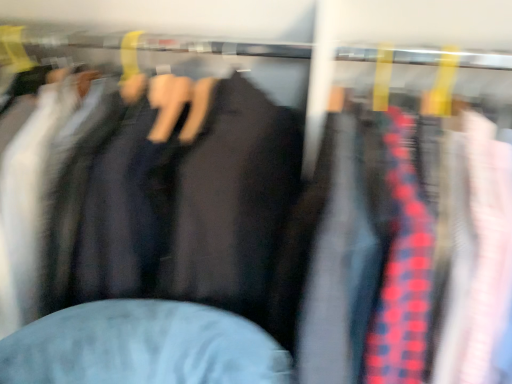
Question: Does matte black jacket at center have a greater width compared to red plaid shirt at right?

Choices:
 (A) yes
 (B) no

Answer: (A)

Question: Is matte black jacket at center at the right side of red plaid shirt at right?

Choices:
 (A) yes
 (B) no

Answer: (B)

Question: From a real-world perspective, is matte black jacket at center beneath red plaid shirt at right?

Choices:
 (A) yes
 (B) no

Answer: (B)

Question: Does matte black jacket at center turn towards red plaid shirt at right?

Choices:
 (A) yes
 (B) no

Answer: (B)

Question: Considering the relative sizes of matte black jacket at center and red plaid shirt at right in the image provided, is matte black jacket at center smaller than red plaid shirt at right?

Choices:
 (A) yes
 (B) no

Answer: (B)

Question: From a real-world perspective, is matte black jacket at center positioned over red plaid shirt at right based on gravity?

Choices:
 (A) no
 (B) yes

Answer: (B)

Question: Could matte black jacket at center be considered to be inside red plaid shirt at right?

Choices:
 (A) no
 (B) yes

Answer: (A)

Question: Is red plaid shirt at right looking in the opposite direction of matte black jacket at center?

Choices:
 (A) yes
 (B) no

Answer: (B)

Question: From the image's perspective, is red plaid shirt at right on top of matte black jacket at center?

Choices:
 (A) no
 (B) yes

Answer: (A)

Question: From a real-world perspective, is red plaid shirt at right on matte black jacket at center?

Choices:
 (A) yes
 (B) no

Answer: (B)

Question: Is the position of red plaid shirt at right more distant than that of matte black jacket at center?

Choices:
 (A) yes
 (B) no

Answer: (B)

Question: Considering the relative positions of red plaid shirt at right and matte black jacket at center in the image provided, is red plaid shirt at right in front of matte black jacket at center?

Choices:
 (A) yes
 (B) no

Answer: (A)

Question: Is matte black jacket at center inside or outside of red plaid shirt at right?

Choices:
 (A) inside
 (B) outside

Answer: (B)